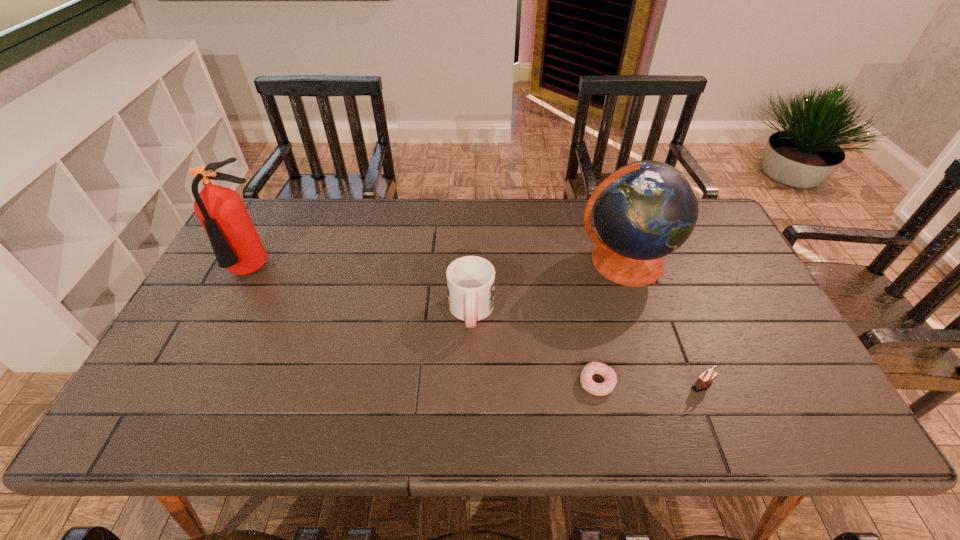
Identify the location of free space that satisfies the following two spatial constraints: 1. at the nozzle of the shortest object; 2. on the right side of the leftmost object. (198, 382).

At what (x,y) coordinates should I click in order to perform the action: click on free spot that satisfies the following two spatial constraints: 1. with the Americas facing the viewer on the globe; 2. on the right side of the fourth tallest object. Please return your answer as a coordinate pair (x, y). The image size is (960, 540). Looking at the image, I should click on (664, 386).

The width and height of the screenshot is (960, 540). What are the coordinates of `free spot that satisfies the following two spatial constraints: 1. with the Americas facing the viewer on the globe; 2. on the right side of the padlock` in the screenshot? It's located at (664, 386).